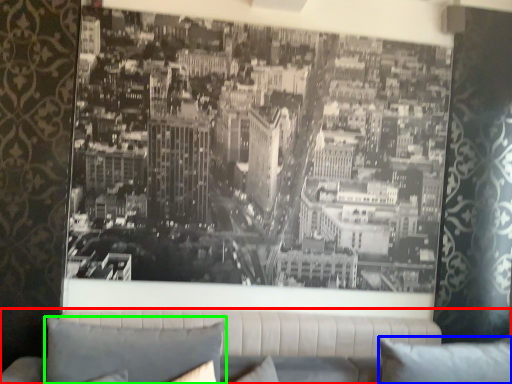
Question: Which object is the closest to the studio couch (highlighted by a red box)? Choose among these: pillow (highlighted by a blue box) or pillow (highlighted by a green box).

Choices:
 (A) pillow
 (B) pillow

Answer: (A)